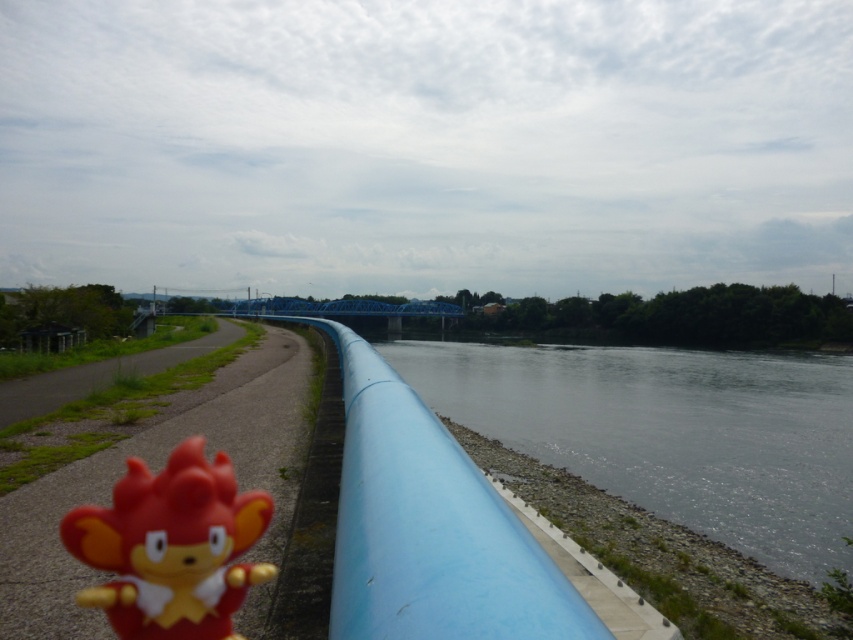
You are a child visiting the scenic outdoor area and see the blue smooth pipe at lower center and the rubber toy at lower left. Which object is bigger?

The blue smooth pipe at lower center is larger in size than the rubber toy at lower left.

You are a maintenance worker needing to retrieve both the blue smooth pipe at lower center and the rubber toy at lower left. Given that your cart can carry items up to 50 meters apart, can you safely transport both items in one trip?

The blue smooth pipe at lower center and the rubber toy at lower left are 46.52 meters apart, so yes, you can safely transport both items in one trip since the distance is within the cart capacity.